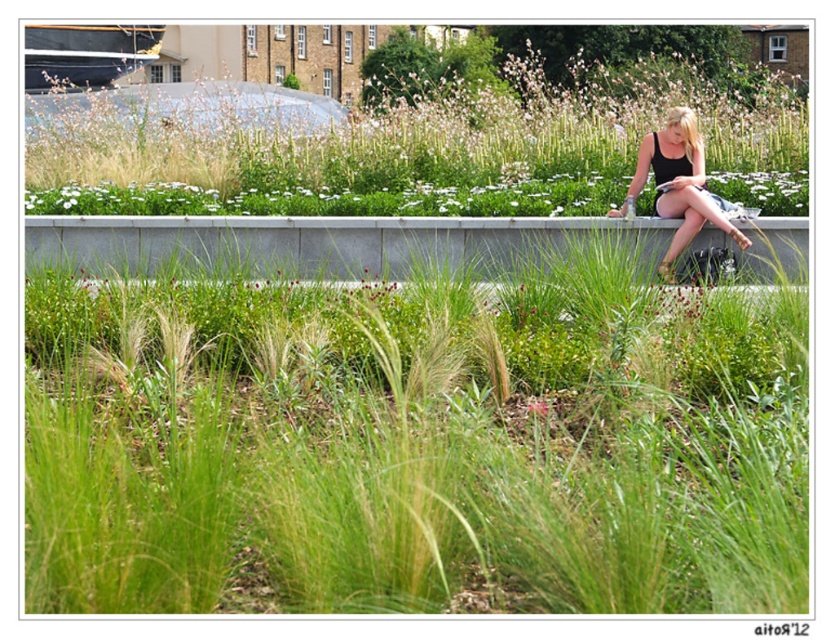
Which is more to the left, green grass at center or black matte tank top at upper right?

Positioned to the left is green grass at center.

Where is `green grass at center`? This screenshot has width=835, height=640. green grass at center is located at coordinates (412, 417).

Does gray concrete ledge at upper center come in front of black matte tank top at upper right?

That is True.

Is gray concrete ledge at upper center to the left of black matte tank top at upper right from the viewer's perspective?

Yes, gray concrete ledge at upper center is to the left of black matte tank top at upper right.

Does point (137, 252) come closer to viewer compared to point (697, 211)?

No, it is not.

At what (x,y) coordinates should I click in order to perform the action: click on gray concrete ledge at upper center. Please return your answer as a coordinate pair (x, y). The height and width of the screenshot is (640, 835). Looking at the image, I should click on (330, 243).

Does green grass at center appear over gray concrete ledge at upper center?

No.

Looking at this image, between green grass at center and gray concrete ledge at upper center, which one has less height?

gray concrete ledge at upper center is shorter.

You are a GUI agent. You are given a task and a screenshot of the screen. Output one action in this format:
    pyautogui.click(x=<x>, y=<y>)
    Task: Click on the green grass at center
    Image resolution: width=835 pixels, height=640 pixels.
    Given the screenshot: What is the action you would take?
    pyautogui.click(x=412, y=417)